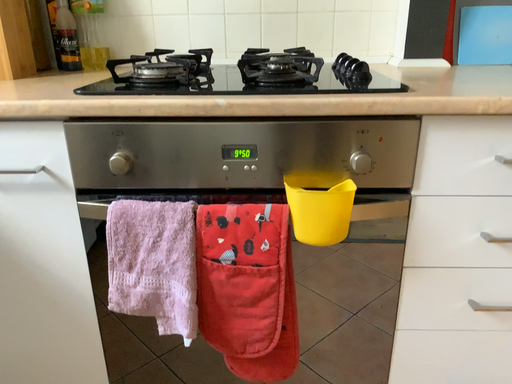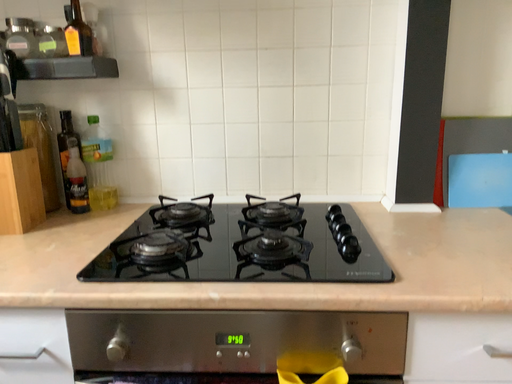
Question: How did the camera likely rotate when shooting the video?

Choices:
 (A) rotated upward
 (B) rotated downward

Answer: (A)